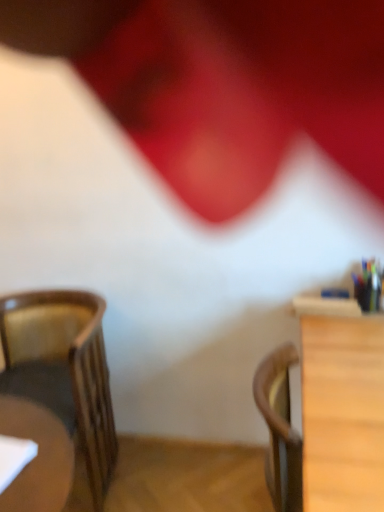
Question: Choose the correct answer: Is wooden table at right inside wooden chair at left or outside it?

Choices:
 (A) outside
 (B) inside

Answer: (A)

Question: In the image, is wooden table at right on the left side or the right side of wooden chair at left?

Choices:
 (A) left
 (B) right

Answer: (B)

Question: In the image, is wooden table at right positioned in front of or behind wooden chair at left?

Choices:
 (A) behind
 (B) front

Answer: (B)

Question: From a real-world perspective, is wooden chair at left above or below wooden table at right?

Choices:
 (A) above
 (B) below

Answer: (B)

Question: From the image's perspective, is wooden chair at left located above or below wooden table at right?

Choices:
 (A) below
 (B) above

Answer: (B)

Question: Is wooden chair at left taller or shorter than wooden table at right?

Choices:
 (A) short
 (B) tall

Answer: (B)

Question: Is point (54, 369) positioned closer to the camera than point (350, 483)?

Choices:
 (A) farther
 (B) closer

Answer: (A)